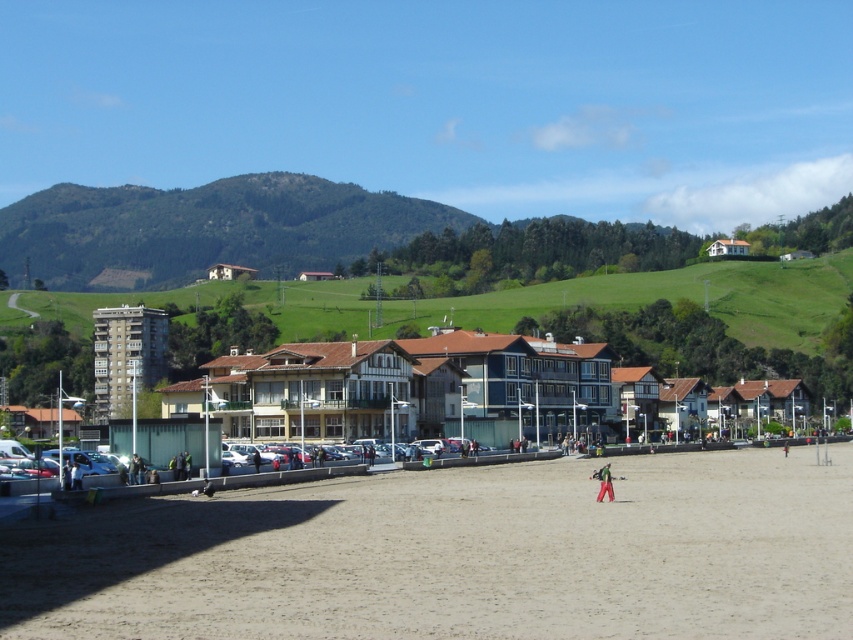
You are standing at the point marked by coordinates point (457,556) in the coastal scene. What type of terrain are you currently standing on?

The point (457,556) corresponds to light brown sand at center, so you are standing on light brown sand at center.

You are standing on the light brown sand at center and want to see the top of the white wooden house at center. Can you see it clearly from your current position?

The light brown sand at center has a lesser height compared to white wooden house at center, so yes, you can see the top of the white wooden house at center clearly from your current position on the light brown sand at center.

You are a photographer standing on the beach and want to take a picture that includes both the green grassy hillside at upper center and the red fabric pants at center. Based on their positions, which object should you pan your camera towards first to ensure both are in frame?

The green grassy hillside at upper center is positioned on the left side of red fabric pants at center, so you should pan your camera towards the green grassy hillside at upper center first to include both in the frame.